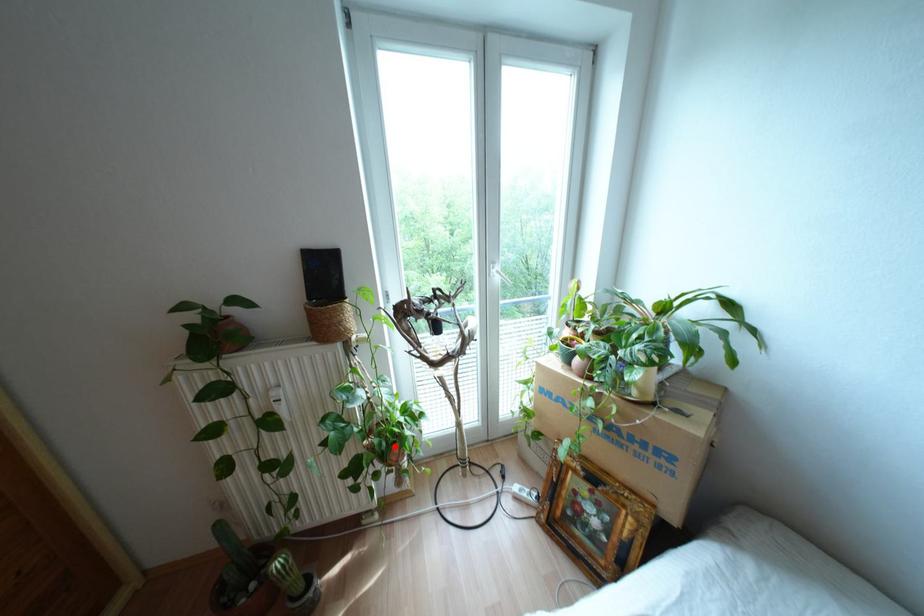
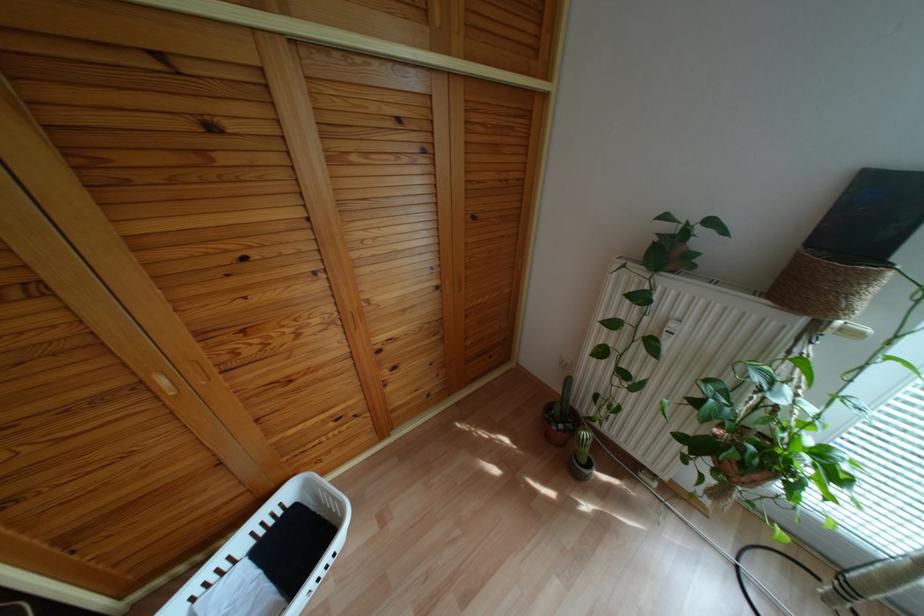
Question: I am providing you with two images of the same scene from different viewpoints. Given a red point in image1, look at the same physical point in image2. Is it:

Choices:
 (A) Closer to the viewpoint
 (B) Farther from the viewpoint

Answer: (A)